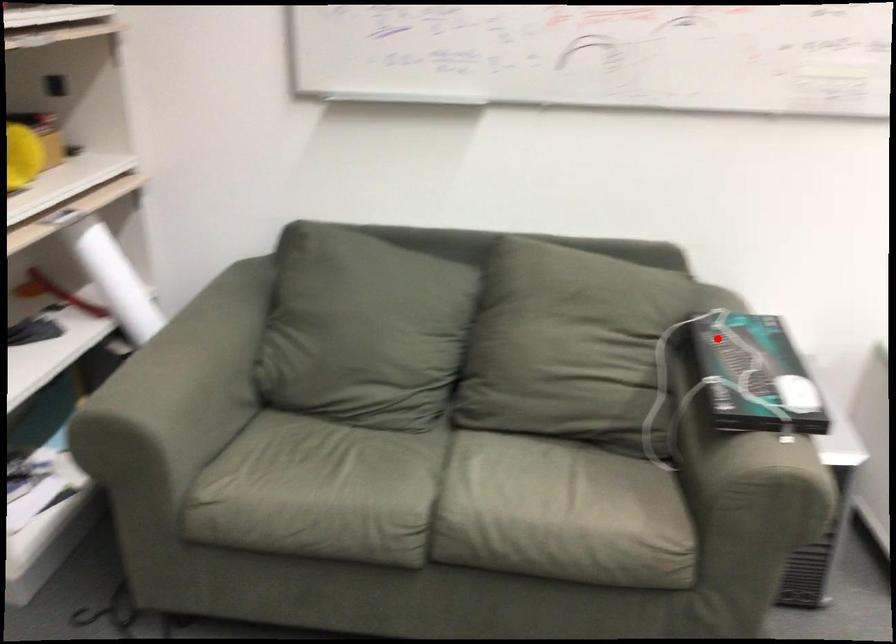
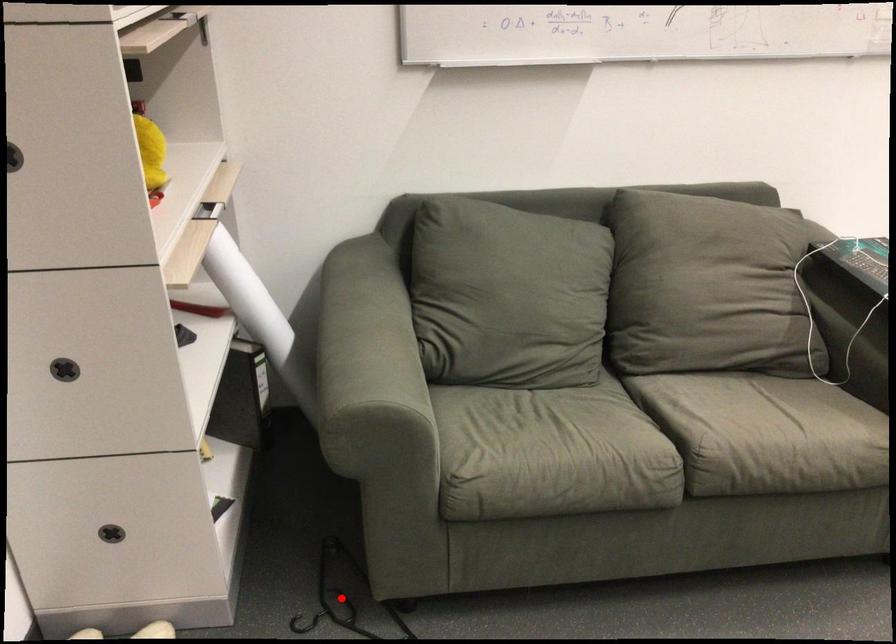
I am providing you with two images of the same scene from different viewpoints. A red point is marked on the first image and another point is marked on the second image. Do the highlighted points in image1 and image2 indicate the same real-world spot?

No